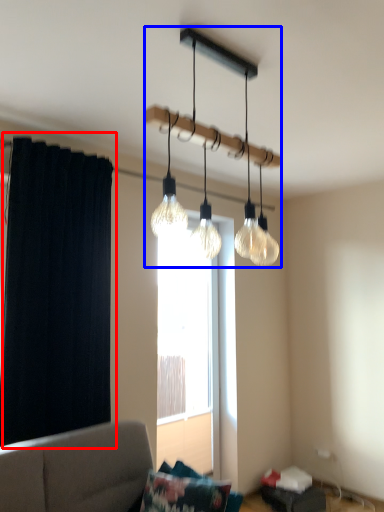
Question: Which of the following is the closest to the observer, curtain (highlighted by a red box) or lamp (highlighted by a blue box)?

Choices:
 (A) curtain
 (B) lamp

Answer: (B)